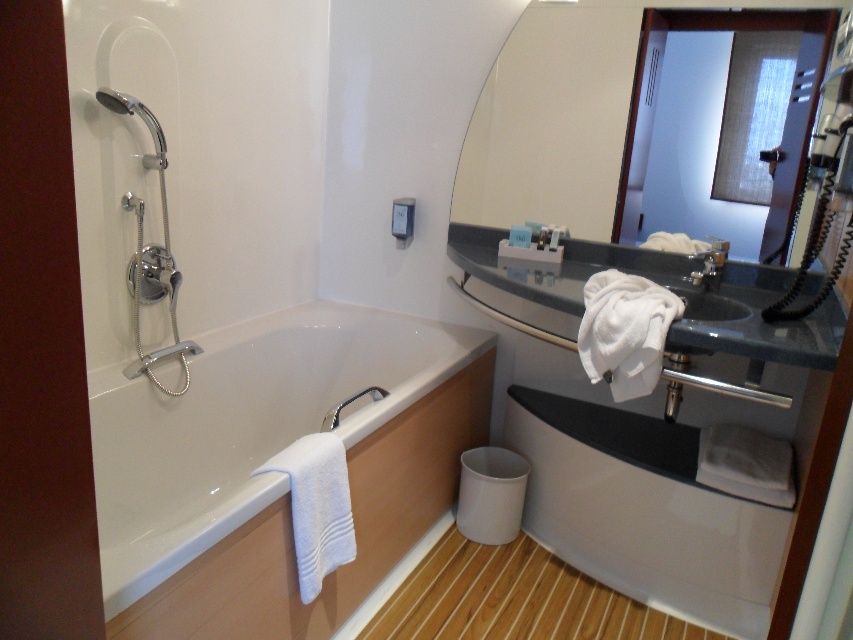
Question: Does matte silver shower head at left have a smaller size compared to white glossy sink at upper center?

Choices:
 (A) no
 (B) yes

Answer: (A)

Question: Which of the following is the closest to the observer?

Choices:
 (A) white glossy bathtub at lower left
 (B) matte silver shower head at left
 (C) white glossy sink at upper center

Answer: (A)

Question: Does clear glass mirror at upper center have a smaller size compared to matte silver shower head at left?

Choices:
 (A) no
 (B) yes

Answer: (A)

Question: Does clear glass mirror at upper center appear on the left side of matte silver shower head at left?

Choices:
 (A) no
 (B) yes

Answer: (A)

Question: Among these objects, which one is nearest to the camera?

Choices:
 (A) clear glass mirror at upper center
 (B) white glossy sink at upper center
 (C) matte silver shower head at left

Answer: (C)

Question: Which point is farther from the camera taking this photo?

Choices:
 (A) (704, 320)
 (B) (505, 72)
 (C) (148, 116)
 (D) (332, 602)

Answer: (B)